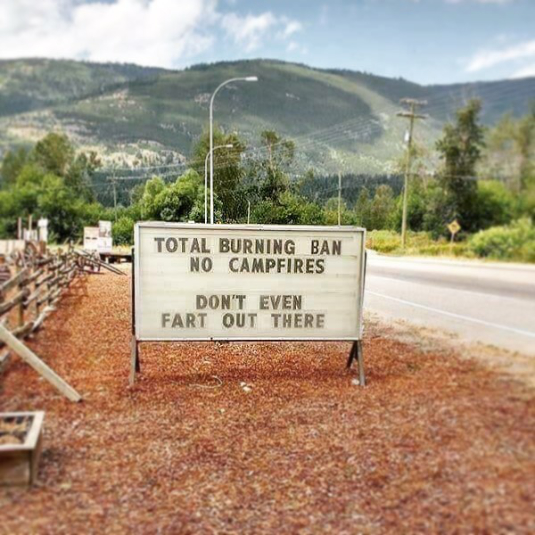
Find the location of a particular element. wooden table is located at coordinates (18, 433).